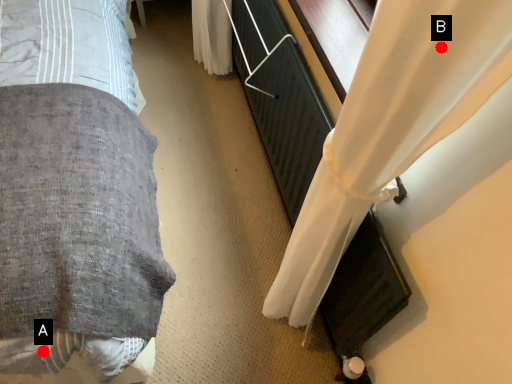
Question: Two points are circled on the image, labeled by A and B beside each circle. Which point is closer to the camera taking this photo?

Choices:
 (A) A is closer
 (B) B is closer

Answer: (B)